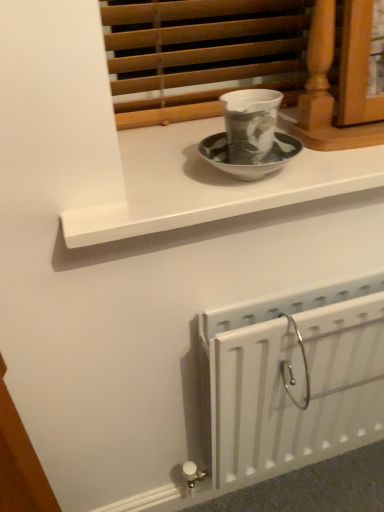
Image resolution: width=384 pixels, height=512 pixels. What do you see at coordinates (208, 184) in the screenshot? I see `white glossy window sill at upper center` at bounding box center [208, 184].

Identify the location of white glossy window sill at upper center. (208, 184).

Where is `white matte radiator at lower right`? The width and height of the screenshot is (384, 512). white matte radiator at lower right is located at coordinates (293, 379).

Measure the distance between point (289, 343) and camera.

Point (289, 343) is 30.83 inches away from camera.

This screenshot has height=512, width=384. What do you see at coordinates (293, 379) in the screenshot?
I see `white matte radiator at lower right` at bounding box center [293, 379].

Locate an element on the screen. white glossy window sill at upper center is located at coordinates (208, 184).

Does white matte radiator at lower right appear on the left side of white glossy window sill at upper center?

No.

Is white matte radiator at lower right closer to the viewer compared to white glossy window sill at upper center?

No, it is not.

Which is behind, point (380, 291) or point (218, 177)?

The point (380, 291) is farther.

From the image's perspective, between white matte radiator at lower right and white glossy window sill at upper center, who is located below?

white matte radiator at lower right, from the image's perspective.

From a real-world perspective, is white matte radiator at lower right below white glossy window sill at upper center?

Yes, from a real-world perspective, white matte radiator at lower right is below white glossy window sill at upper center.

Considering the sizes of objects white matte radiator at lower right and white glossy window sill at upper center in the image provided, who is wider, white matte radiator at lower right or white glossy window sill at upper center?

white glossy window sill at upper center.

Considering the relative sizes of white matte radiator at lower right and white glossy window sill at upper center in the image provided, is white matte radiator at lower right shorter than white glossy window sill at upper center?

Incorrect, the height of white matte radiator at lower right does not fall short of that of white glossy window sill at upper center.

Which of these two, white matte radiator at lower right or white glossy window sill at upper center, is bigger?

white matte radiator at lower right.

Can white glossy window sill at upper center be found inside white matte radiator at lower right?

Definitely not — white glossy window sill at upper center is not inside white matte radiator at lower right.

Is white matte radiator at lower right far away from white glossy window sill at upper center?

They are positioned close to each other.

Does white matte radiator at lower right turn towards white glossy window sill at upper center?

No, white matte radiator at lower right is not oriented towards white glossy window sill at upper center.

Where is `radiator directly beneath the white glossy window sill at upper center (from a real-world perspective)`? radiator directly beneath the white glossy window sill at upper center (from a real-world perspective) is located at coordinates (293, 379).

Visually, is white glossy window sill at upper center positioned to the left or to the right of white matte radiator at lower right?

Based on their positions, white glossy window sill at upper center is located to the left of white matte radiator at lower right.

Considering the relative positions of white glossy window sill at upper center and white matte radiator at lower right in the image provided, is white glossy window sill at upper center in front of white matte radiator at lower right?

Yes.

Does point (185, 139) appear closer or farther from the camera than point (350, 409)?

Point (185, 139) is closer to the camera than point (350, 409).

From the image's perspective, which one is positioned lower, white glossy window sill at upper center or white matte radiator at lower right?

white matte radiator at lower right.

From a real-world perspective, is white glossy window sill at upper center located higher than white matte radiator at lower right?

Yes, from a real-world perspective, white glossy window sill at upper center is over white matte radiator at lower right

Looking at their sizes, would you say white glossy window sill at upper center is wider or thinner than white matte radiator at lower right?

white glossy window sill at upper center is wider than white matte radiator at lower right.

Is white glossy window sill at upper center shorter than white matte radiator at lower right?

Yes.

Who is bigger, white glossy window sill at upper center or white matte radiator at lower right?

white matte radiator at lower right is bigger.

Looking at this image, would you say white glossy window sill at upper center contains white matte radiator at lower right?

Definitely not — white matte radiator at lower right is not inside white glossy window sill at upper center.

Are white glossy window sill at upper center and white matte radiator at lower right located far from each other?

white glossy window sill at upper center is actually quite close to white matte radiator at lower right.

Is white glossy window sill at upper center aimed at white matte radiator at lower right?

No, white glossy window sill at upper center is not turned towards white matte radiator at lower right.

Where is `window sill in front of the white matte radiator at lower right`? The width and height of the screenshot is (384, 512). window sill in front of the white matte radiator at lower right is located at coordinates (208, 184).

There is a white matte radiator at lower right. At what (x,y) coordinates should I click in order to perform the action: click on window sill above it (from a real-world perspective). Please return your answer as a coordinate pair (x, y). Looking at the image, I should click on (208, 184).

Identify the location of window sill in front of the white matte radiator at lower right. (208, 184).